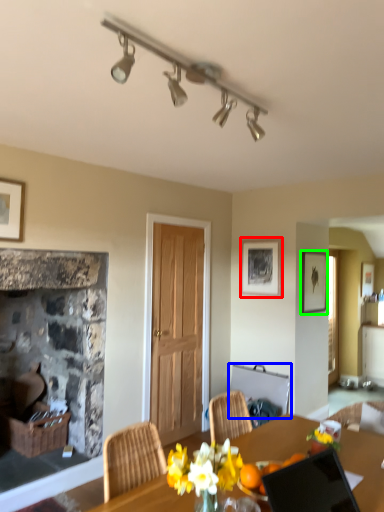
Question: Considering the real-world distances, which object is farthest from picture frame (highlighted by a red box)? chair (highlighted by a blue box) or picture frame (highlighted by a green box)?

Choices:
 (A) chair
 (B) picture frame

Answer: (A)